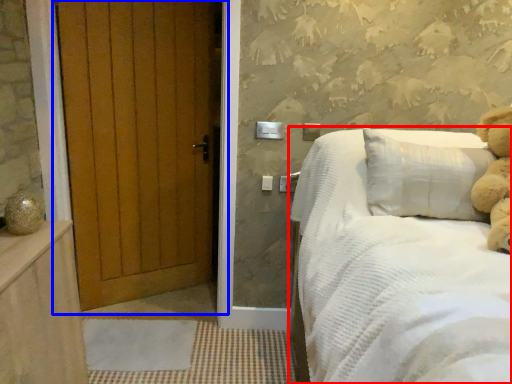
Question: Which object appears closest to the camera in this image, bed (highlighted by a red box) or door (highlighted by a blue box)?

Choices:
 (A) bed
 (B) door

Answer: (A)